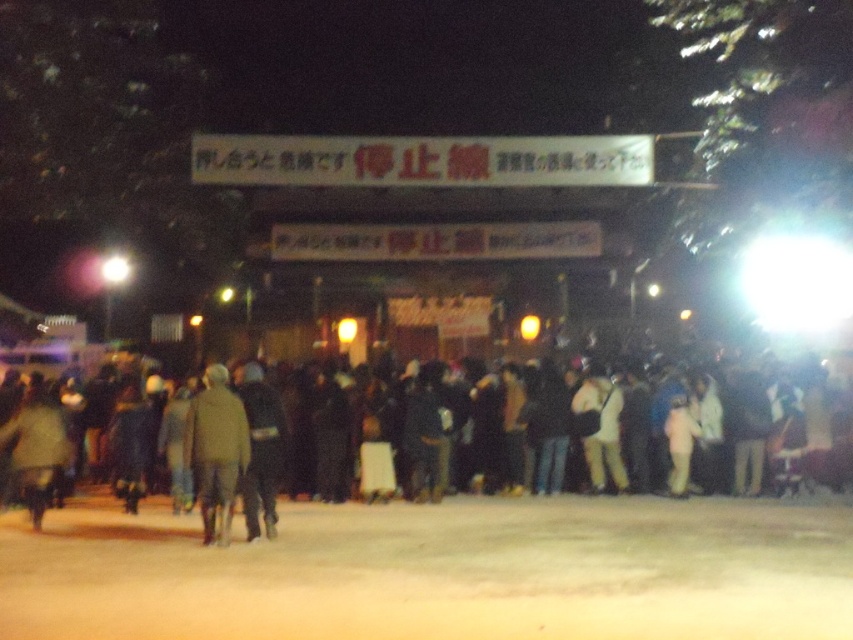
Question: Does black fabric crowd at center have a lesser width compared to dark green jacket at center?

Choices:
 (A) yes
 (B) no

Answer: (B)

Question: Can you confirm if black fabric crowd at center is positioned to the left of dark green jacket at center?

Choices:
 (A) no
 (B) yes

Answer: (A)

Question: Does black fabric crowd at center appear over dark green jacket at center?

Choices:
 (A) yes
 (B) no

Answer: (B)